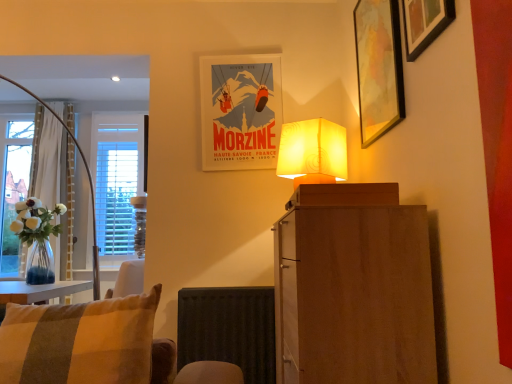
This screenshot has width=512, height=384. What are the coordinates of `black matte radiator at lower center` in the screenshot? It's located at (229, 329).

The width and height of the screenshot is (512, 384). Describe the element at coordinates (97, 345) in the screenshot. I see `striped fabric cushion at lower left` at that location.

Consider the image. Measure the distance between point [159,381] and camera.

Point [159,381] and camera are 4.60 feet apart from each other.

What do you see at coordinates (378, 67) in the screenshot? I see `wooden picture frame at upper right, which is counted as the second picture frame, starting from the left` at bounding box center [378, 67].

Find the location of a particular element. The image size is (512, 384). wooden picture frame at upper right, the second picture frame in the right-to-left sequence is located at coordinates (378, 67).

What do you see at coordinates (118, 181) in the screenshot? The height and width of the screenshot is (384, 512). I see `white wooden blinds at left` at bounding box center [118, 181].

This screenshot has height=384, width=512. What are the coordinates of `wooden picture frame at upper right, positioned as the 1th picture frame in front-to-back order` in the screenshot? It's located at (424, 23).

Is wooden picture frame at upper right, placed as the third picture frame when sorted from left to right, facing towards wooden cabinet at center?

No, wooden picture frame at upper right, placed as the third picture frame when sorted from left to right, does not turn towards wooden cabinet at center.

From a real-world perspective, which object rests below the other?

From a 3D spatial view, wooden cabinet at center is below.

Can we say wooden picture frame at upper right, positioned as the 1th picture frame in front-to-back order, lies outside wooden cabinet at center?

Yes, wooden picture frame at upper right, positioned as the 1th picture frame in front-to-back order, is located beyond the bounds of wooden cabinet at center.

Is wooden picture frame at upper right, the 3th picture frame positioned from the back, bigger than wooden cabinet at center?

No, wooden picture frame at upper right, the 3th picture frame positioned from the back, is not bigger than wooden cabinet at center.

Considering the relative sizes of wooden picture frame at upper right, the 2th picture frame in the front-to-back sequence, and white sheer curtain at left in the image provided, is wooden picture frame at upper right, the 2th picture frame in the front-to-back sequence, bigger than white sheer curtain at left?

No.

Measure the distance from wooden picture frame at upper right, which is counted as the second picture frame, starting from the left, to white sheer curtain at left.

The distance of wooden picture frame at upper right, which is counted as the second picture frame, starting from the left, from white sheer curtain at left is 9.83 feet.

From the picture: Does wooden picture frame at upper right, which is counted as the second picture frame, starting from the left, have a lesser width compared to white sheer curtain at left?

Indeed, wooden picture frame at upper right, which is counted as the second picture frame, starting from the left, has a lesser width compared to white sheer curtain at left.

Does wooden picture frame at upper right, which is counted as the 2th picture frame, starting from the back, have a greater height compared to white sheer curtain at left?

In fact, wooden picture frame at upper right, which is counted as the 2th picture frame, starting from the back, may be shorter than white sheer curtain at left.

Is striped fabric cushion at lower left positioned with its back to wooden picture frame at upper right, which is counted as the second picture frame, starting from the left?

No, wooden picture frame at upper right, which is counted as the second picture frame, starting from the left, is not at the back of striped fabric cushion at lower left.

From a real-world perspective, who is located lower, striped fabric cushion at lower left or wooden picture frame at upper right, which is counted as the second picture frame, starting from the left?

striped fabric cushion at lower left, from a real-world perspective.

Which of these two, striped fabric cushion at lower left or wooden picture frame at upper right, which is counted as the 2th picture frame, starting from the back, is smaller?

wooden picture frame at upper right, which is counted as the 2th picture frame, starting from the back, is smaller.

Considering the relative sizes of white wooden blinds at left and wooden picture frame at upper right, the 2th picture frame in the front-to-back sequence, in the image provided, is white wooden blinds at left smaller than wooden picture frame at upper right, the 2th picture frame in the front-to-back sequence,?

No.

Is white wooden blinds at left placed right next to wooden picture frame at upper right, the second picture frame in the right-to-left sequence?

No, white wooden blinds at left is not making contact with wooden picture frame at upper right, the second picture frame in the right-to-left sequence.

Can you tell me how much white wooden blinds at left and wooden picture frame at upper right, which is counted as the second picture frame, starting from the left, differ in facing direction?

89.3 degrees separate the facing orientations of white wooden blinds at left and wooden picture frame at upper right, which is counted as the second picture frame, starting from the left.

Considering the sizes of objects white wooden blinds at left and matte paper poster at upper center, the 3th picture frame in the front-to-back sequence, in the image provided, who is bigger, white wooden blinds at left or matte paper poster at upper center, the 3th picture frame in the front-to-back sequence,?

white wooden blinds at left is bigger.

Considering the relative positions of white wooden blinds at left and matte paper poster at upper center, which is the first picture frame from back to front, in the image provided, is white wooden blinds at left to the left of matte paper poster at upper center, which is the first picture frame from back to front, from the viewer's perspective?

Correct, you'll find white wooden blinds at left to the left of matte paper poster at upper center, which is the first picture frame from back to front.

Is white wooden blinds at left wider than matte paper poster at upper center, the 1th picture frame viewed from the left?

Indeed, white wooden blinds at left has a greater width compared to matte paper poster at upper center, the 1th picture frame viewed from the left.

From a real-world perspective, is white wooden blinds at left beneath matte paper poster at upper center, the 1th picture frame viewed from the left?

Yes, from a real-world perspective, white wooden blinds at left is below matte paper poster at upper center, the 1th picture frame viewed from the left.

Is wooden cabinet at center to the left of wooden picture frame at upper right, placed as the third picture frame when sorted from left to right, from the viewer's perspective?

Correct, you'll find wooden cabinet at center to the left of wooden picture frame at upper right, placed as the third picture frame when sorted from left to right.

Which is correct: wooden cabinet at center is inside wooden picture frame at upper right, which is counted as the 1th picture frame, starting from the right, or outside of it?

wooden cabinet at center cannot be found inside wooden picture frame at upper right, which is counted as the 1th picture frame, starting from the right.

In terms of height, does wooden cabinet at center look taller or shorter compared to wooden picture frame at upper right, which is counted as the 1th picture frame, starting from the right?

Clearly, wooden cabinet at center is taller compared to wooden picture frame at upper right, which is counted as the 1th picture frame, starting from the right.

This screenshot has width=512, height=384. Identify the location of the 3rd picture frame positioned above the wooden cabinet at center (from the image's perspective). (424, 23).

How much distance is there between striped fabric cushion at lower left and black matte radiator at lower center?

striped fabric cushion at lower left and black matte radiator at lower center are 38.90 inches apart from each other.

Considering their positions, is striped fabric cushion at lower left located in front of or behind black matte radiator at lower center?

In the image, striped fabric cushion at lower left appears in front of black matte radiator at lower center.

From the picture: Is striped fabric cushion at lower left wider or thinner than black matte radiator at lower center?

striped fabric cushion at lower left is wider than black matte radiator at lower center.

From the image's perspective, is striped fabric cushion at lower left located above or below black matte radiator at lower center?

Based on their image positions, striped fabric cushion at lower left is located above black matte radiator at lower center.

Identify the location of picture frame that is the 2nd one above the wooden cabinet at center (from a real-world perspective). (424, 23).

You are a GUI agent. You are given a task and a screenshot of the screen. Output one action in this format:
    pyautogui.click(x=<x>, y=<y>)
    Task: Click on the curtain that is on the left side of wooden picture frame at upper right, the 2th picture frame in the front-to-back sequence
    Image resolution: width=512 pixels, height=384 pixels.
    Given the screenshot: What is the action you would take?
    pyautogui.click(x=46, y=159)

Considering their positions, is black matte radiator at lower center positioned further to wooden cabinet at center than wooden picture frame at upper right, the 2th picture frame in the front-to-back sequence?

Based on the image, black matte radiator at lower center appears to be further to wooden cabinet at center.

From the picture: Based on their spatial positions, is white wooden blinds at left or wooden cabinet at center further from wooden picture frame at upper right, positioned as the 1th picture frame in front-to-back order?

white wooden blinds at left lies further to wooden picture frame at upper right, positioned as the 1th picture frame in front-to-back order, than the other object.

From the image, which object appears to be farther from wooden picture frame at upper right, positioned as the 1th picture frame in front-to-back order, matte paper poster at upper center, the 3th picture frame in the front-to-back sequence, or wooden picture frame at upper right, the second picture frame in the right-to-left sequence?

matte paper poster at upper center, the 3th picture frame in the front-to-back sequence, lies further to wooden picture frame at upper right, positioned as the 1th picture frame in front-to-back order, than the other object.

Based on their spatial positions, is black matte radiator at lower center or white sheer curtain at left closer to wooden picture frame at upper right, which is counted as the 1th picture frame, starting from the right?

Based on the image, black matte radiator at lower center appears to be nearer to wooden picture frame at upper right, which is counted as the 1th picture frame, starting from the right.

Estimate the real-world distances between objects in this image. Which object is closer to matte paper poster at upper center, the third picture frame viewed from the right, black matte radiator at lower center or white wooden blinds at left?

Based on the image, black matte radiator at lower center appears to be nearer to matte paper poster at upper center, the third picture frame viewed from the right.

From the image, which object appears to be farther from matte paper poster at upper center, the third picture frame viewed from the right, white wooden blinds at left or wooden picture frame at upper right, which is counted as the 2th picture frame, starting from the back?

Based on the image, white wooden blinds at left appears to be further to matte paper poster at upper center, the third picture frame viewed from the right.

When comparing their distances from wooden picture frame at upper right, which is counted as the 2th picture frame, starting from the back, does white sheer curtain at left or matte paper poster at upper center, the 1th picture frame viewed from the left, seem closer?

matte paper poster at upper center, the 1th picture frame viewed from the left, lies closer to wooden picture frame at upper right, which is counted as the 2th picture frame, starting from the back, than the other object.

From the image, which object appears to be nearer to black matte radiator at lower center, matte paper poster at upper center, the third picture frame viewed from the right, or white sheer curtain at left?

matte paper poster at upper center, the third picture frame viewed from the right, is positioned closer to the anchor black matte radiator at lower center.

You are a GUI agent. You are given a task and a screenshot of the screen. Output one action in this format:
    pyautogui.click(x=<x>, y=<y>)
    Task: Click on the radiator situated between white sheer curtain at left and matte paper poster at upper center, which is the first picture frame from back to front, from left to right
    The height and width of the screenshot is (384, 512).
    Given the screenshot: What is the action you would take?
    pyautogui.click(x=229, y=329)

Locate an element on the screen. The image size is (512, 384). cabinetry located between wooden picture frame at upper right, the 3th picture frame positioned from the back, and white wooden blinds at left in the depth direction is located at coordinates (353, 287).

Where is `cabinetry between striped fabric cushion at lower left and black matte radiator at lower center along the z-axis`? This screenshot has width=512, height=384. cabinetry between striped fabric cushion at lower left and black matte radiator at lower center along the z-axis is located at coordinates (353, 287).

Image resolution: width=512 pixels, height=384 pixels. I want to click on chair between wooden picture frame at upper right, which is counted as the 1th picture frame, starting from the right, and wooden cabinet at center from top to bottom, so click(97, 345).